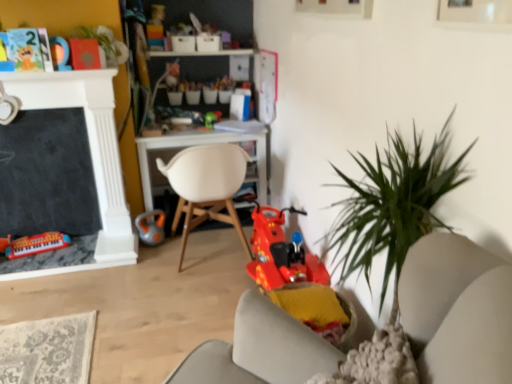
Find the location of a particular element. The width and height of the screenshot is (512, 384). free space to the left of white matte chair at center is located at coordinates (134, 272).